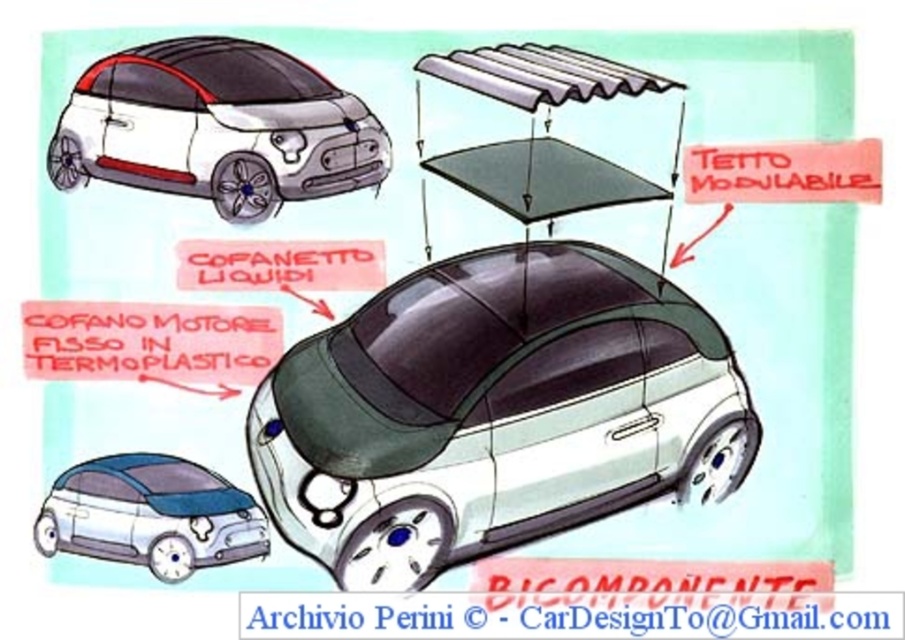
You are an automotive designer reviewing a concept illustration. You notice the green matte car at center and the white matte car at upper left. Which car is positioned lower in the image?

The green matte car at center is located below the white matte car at upper left, so it is positioned lower in the image.

You are a car designer evaluating two concept cars in the image. The green matte car at center and the matte blue car at lower left. Which car would you recommend for a project requiring a taller vehicle?

The green matte car at center is much taller than the matte blue car at lower left, so it would be the better choice for a project requiring a taller vehicle.

You are an automotive designer working on a scale model. You have a workspace that is 15 inches wide. You need to place both the white matte car at upper left and the matte blue car at lower left on this workspace. Can you fit both cars side by side without overlapping?

The distance between the white matte car at upper left and matte blue car at lower left is 14.98 inches, which is just under 15 inches. Therefore, both cars can fit side by side within the 15 inch workspace without overlapping.